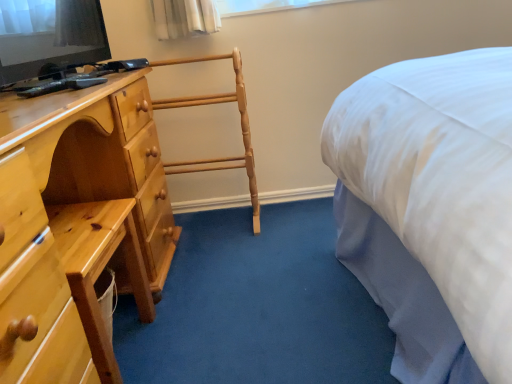
Question: Are light brown wood towel rack at center and matte black television at upper left located far from each other?

Choices:
 (A) no
 (B) yes

Answer: (A)

Question: Can you confirm if light brown wood towel rack at center is positioned to the left of matte black television at upper left?

Choices:
 (A) no
 (B) yes

Answer: (A)

Question: Does light brown wood towel rack at center have a lesser height compared to matte black television at upper left?

Choices:
 (A) yes
 (B) no

Answer: (B)

Question: From the image's perspective, does light brown wood towel rack at center appear lower than matte black television at upper left?

Choices:
 (A) no
 (B) yes

Answer: (B)

Question: Is light brown wood towel rack at center oriented away from matte black television at upper left?

Choices:
 (A) yes
 (B) no

Answer: (B)

Question: Does light brown wood towel rack at center have a larger size compared to matte black television at upper left?

Choices:
 (A) no
 (B) yes

Answer: (B)

Question: Considering the relative sizes of white glass window at upper center and light brown wood towel rack at center in the image provided, is white glass window at upper center wider than light brown wood towel rack at center?

Choices:
 (A) yes
 (B) no

Answer: (B)

Question: Is the depth of white glass window at upper center less than that of light brown wood towel rack at center?

Choices:
 (A) yes
 (B) no

Answer: (B)

Question: Is white glass window at upper center oriented towards light brown wood towel rack at center?

Choices:
 (A) yes
 (B) no

Answer: (B)

Question: From the image's perspective, is white glass window at upper center above light brown wood towel rack at center?

Choices:
 (A) no
 (B) yes

Answer: (B)

Question: Could light brown wood towel rack at center be considered to be inside white glass window at upper center?

Choices:
 (A) no
 (B) yes

Answer: (A)

Question: From the image's perspective, does white glass window at upper center appear lower than light brown wood towel rack at center?

Choices:
 (A) no
 (B) yes

Answer: (A)

Question: Is there a large distance between white glass window at upper center and light brown wooden chest of drawers at left?

Choices:
 (A) no
 (B) yes

Answer: (A)